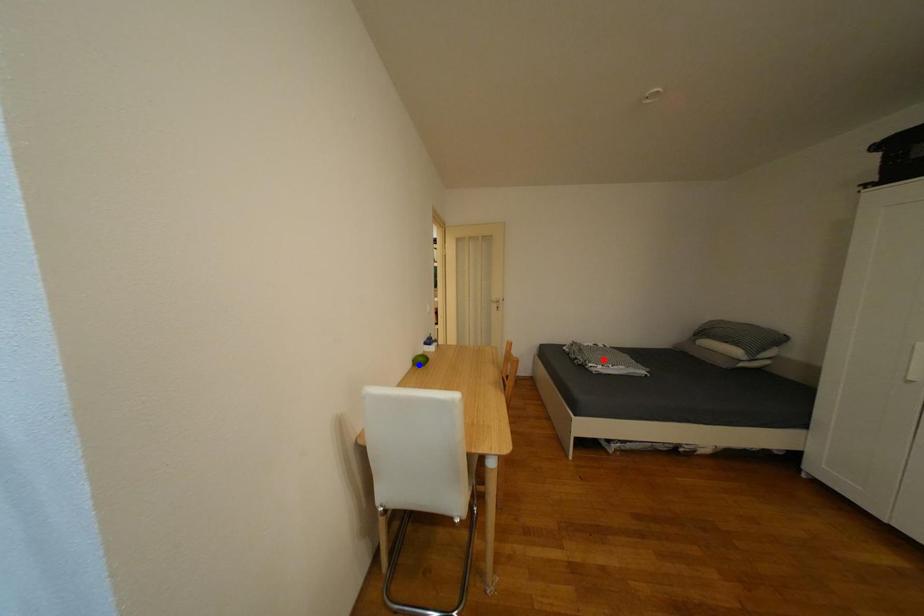
Question: Two points are marked on the image. Which point is closer to the camera?

Choices:
 (A) Blue point is closer.
 (B) Red point is closer.

Answer: (A)